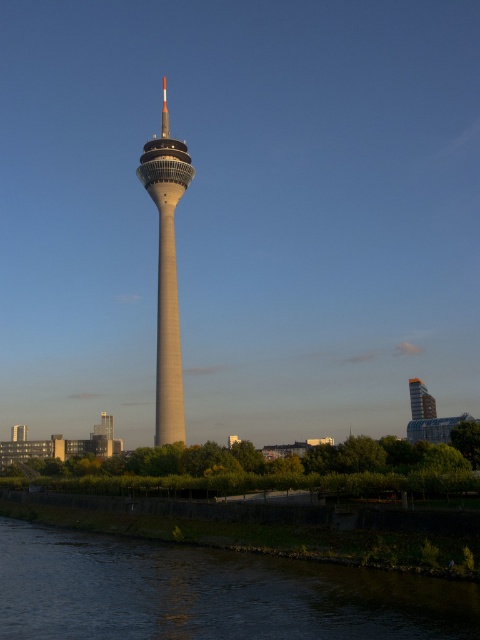
Question: Among these objects, which one is nearest to the camera?

Choices:
 (A) metallic glass skyscraper at right
 (B) dark water at lower left
 (C) smooth concrete tower at center

Answer: (B)

Question: Which of the following is the closest to the observer?

Choices:
 (A) dark water at lower left
 (B) metallic glass skyscraper at right
 (C) smooth concrete tower at center

Answer: (A)

Question: Is dark water at lower left thinner than smooth concrete tower at center?

Choices:
 (A) no
 (B) yes

Answer: (A)

Question: Which object is the farthest from the metallic glass skyscraper at right?

Choices:
 (A) dark water at lower left
 (B) smooth concrete tower at center

Answer: (A)

Question: From the image, what is the correct spatial relationship of dark water at lower left in relation to metallic glass skyscraper at right?

Choices:
 (A) below
 (B) above

Answer: (A)

Question: Can you confirm if smooth concrete tower at center is thinner than metallic glass skyscraper at right?

Choices:
 (A) no
 (B) yes

Answer: (A)